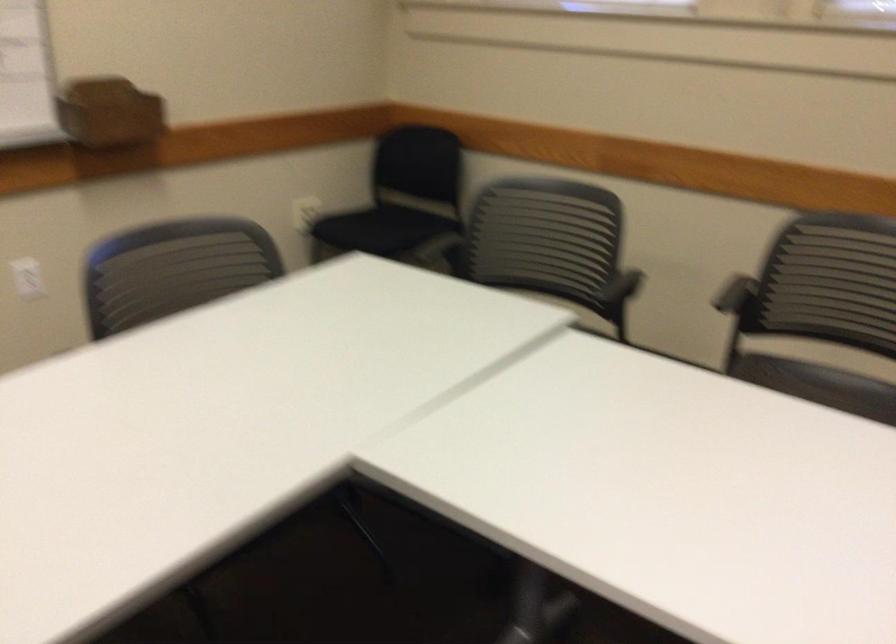
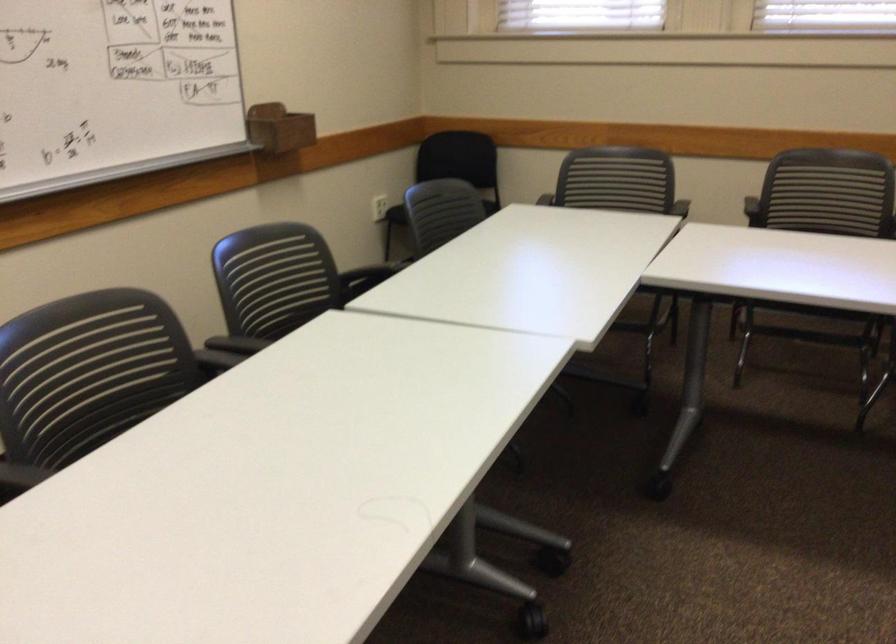
The point at (245, 259) is marked in the first image. Where is the corresponding point in the second image?

(441, 212)